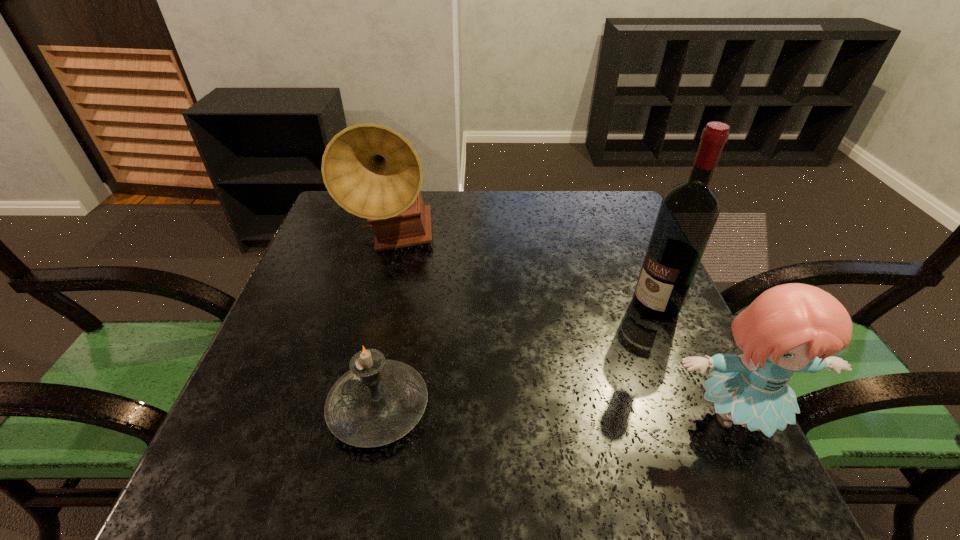
This screenshot has width=960, height=540. I want to click on the shortest object, so click(378, 401).

You are a GUI agent. You are given a task and a screenshot of the screen. Output one action in this format:
    pyautogui.click(x=<x>, y=<y>)
    Task: Click on the second shortest object
    Image resolution: width=960 pixels, height=540 pixels.
    Given the screenshot: What is the action you would take?
    pyautogui.click(x=794, y=327)

What are the coordinates of `the farthest object` in the screenshot? It's located at (372, 171).

Where is `phonograph record`? The height and width of the screenshot is (540, 960). phonograph record is located at coordinates (372, 171).

Identify the location of the second farthest object. This screenshot has width=960, height=540. (688, 212).

You are a GUI agent. You are given a task and a screenshot of the screen. Output one action in this format:
    pyautogui.click(x=<x>, y=<y>)
    Task: Click on the vacant region located on the back of the candle
    This screenshot has width=960, height=540.
    Given the screenshot: What is the action you would take?
    pyautogui.click(x=391, y=348)

Locate an element on the screen. This screenshot has width=960, height=540. vacant space located 0.150m on the horn of the phonograph record is located at coordinates (444, 302).

Image resolution: width=960 pixels, height=540 pixels. In order to click on vacant space located on the horn of the phonograph record in this screenshot , I will do pos(458,318).

Where is `vacant space situated 0.190m on the horn of the phonograph record`? vacant space situated 0.190m on the horn of the phonograph record is located at coordinates (453, 312).

Where is `blank space located 0.130m on the front and back of the alcohol`? Image resolution: width=960 pixels, height=540 pixels. blank space located 0.130m on the front and back of the alcohol is located at coordinates (604, 346).